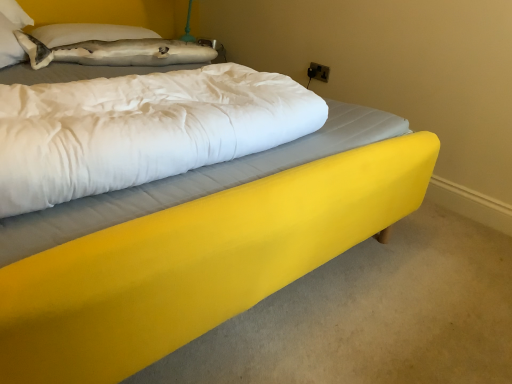
Question: Can you confirm if gray fabric pillow at upper left is taller than yellow fabric mattress at center?

Choices:
 (A) yes
 (B) no

Answer: (B)

Question: Is gray fabric pillow at upper left far away from yellow fabric mattress at center?

Choices:
 (A) no
 (B) yes

Answer: (B)

Question: From a real-world perspective, is gray fabric pillow at upper left on yellow fabric mattress at center?

Choices:
 (A) no
 (B) yes

Answer: (A)

Question: Is gray fabric pillow at upper left facing towards yellow fabric mattress at center?

Choices:
 (A) no
 (B) yes

Answer: (B)

Question: Is gray fabric pillow at upper left closer to camera compared to yellow fabric mattress at center?

Choices:
 (A) no
 (B) yes

Answer: (A)

Question: From the image's perspective, would you say gray fabric pillow at upper left is positioned over yellow fabric mattress at center?

Choices:
 (A) no
 (B) yes

Answer: (B)

Question: Can you confirm if yellow fabric mattress at center is thinner than gray fabric pillow at upper left?

Choices:
 (A) yes
 (B) no

Answer: (B)

Question: From the image's perspective, does yellow fabric mattress at center appear lower than gray fabric pillow at upper left?

Choices:
 (A) yes
 (B) no

Answer: (A)

Question: From the image's perspective, is yellow fabric mattress at center on gray fabric pillow at upper left?

Choices:
 (A) no
 (B) yes

Answer: (A)

Question: Is yellow fabric mattress at center surrounding gray fabric pillow at upper left?

Choices:
 (A) no
 (B) yes

Answer: (A)

Question: Considering the relative positions of yellow fabric mattress at center and gray fabric pillow at upper left in the image provided, is yellow fabric mattress at center to the left of gray fabric pillow at upper left from the viewer's perspective?

Choices:
 (A) yes
 (B) no

Answer: (B)

Question: Is yellow fabric mattress at center beside gray fabric pillow at upper left?

Choices:
 (A) no
 (B) yes

Answer: (A)

Question: From a real-world perspective, is yellow fabric mattress at center physically located above or below gray fabric pillow at upper left?

Choices:
 (A) below
 (B) above

Answer: (B)